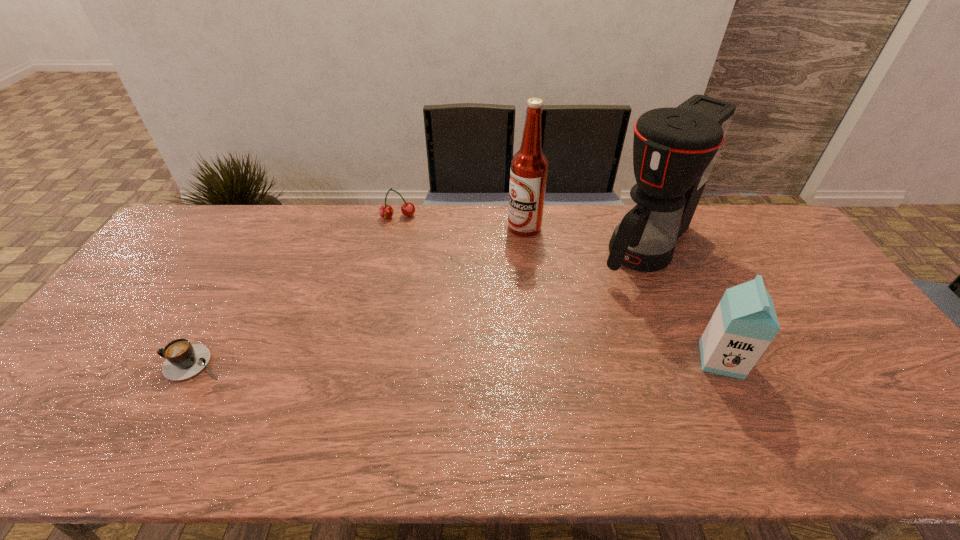
The width and height of the screenshot is (960, 540). Identify the location of unoccupied position between the milk carton and the coffee maker. (684, 303).

At what (x,y) coordinates should I click in order to perform the action: click on empty space that is in between the second shortest object and the milk carton. Please return your answer as a coordinate pair (x, y). Looking at the image, I should click on (560, 288).

You are a GUI agent. You are given a task and a screenshot of the screen. Output one action in this format:
    pyautogui.click(x=<x>, y=<y>)
    Task: Click on the free space between the third tallest object and the cappuccino
    
    Given the screenshot: What is the action you would take?
    pyautogui.click(x=459, y=361)

Image resolution: width=960 pixels, height=540 pixels. Identify the location of empty location between the shortest object and the coffee maker. (421, 305).

The image size is (960, 540). I want to click on the closest object to the third object from left to right, so click(x=674, y=149).

Locate which object is the second closest to the third shortest object. Please provide its 2D coordinates. Your answer should be formatted as a tuple, i.e. [(x, y)], where the tuple contains the x and y coordinates of a point satisfying the conditions above.

[(529, 166)]